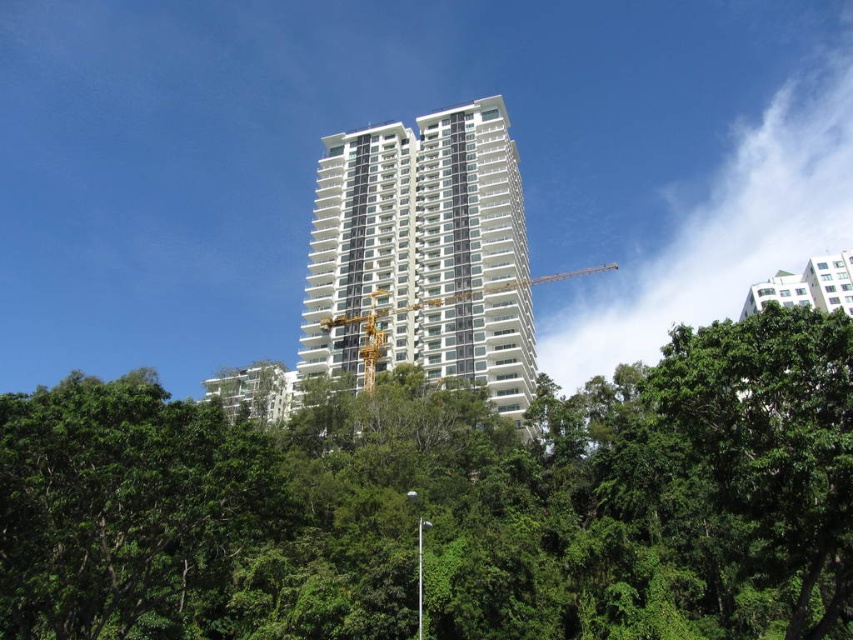
Question: Among these objects, which one is nearest to the camera?

Choices:
 (A) white glossy building at center
 (B) green leafy tree at center

Answer: (B)

Question: Among these objects, which one is nearest to the camera?

Choices:
 (A) yellow metallic crane at center
 (B) white glossy building at center

Answer: (B)

Question: Where is green leafy tree at center located in relation to yellow metallic crane at center in the image?

Choices:
 (A) above
 (B) below

Answer: (B)

Question: In this image, where is green leafy tree at center located relative to yellow metallic crane at center?

Choices:
 (A) above
 (B) below

Answer: (B)

Question: Can you confirm if green leafy tree at center is positioned above yellow metallic crane at center?

Choices:
 (A) yes
 (B) no

Answer: (B)

Question: Which object is closer to the camera taking this photo?

Choices:
 (A) green leafy tree at center
 (B) yellow metallic crane at center

Answer: (A)